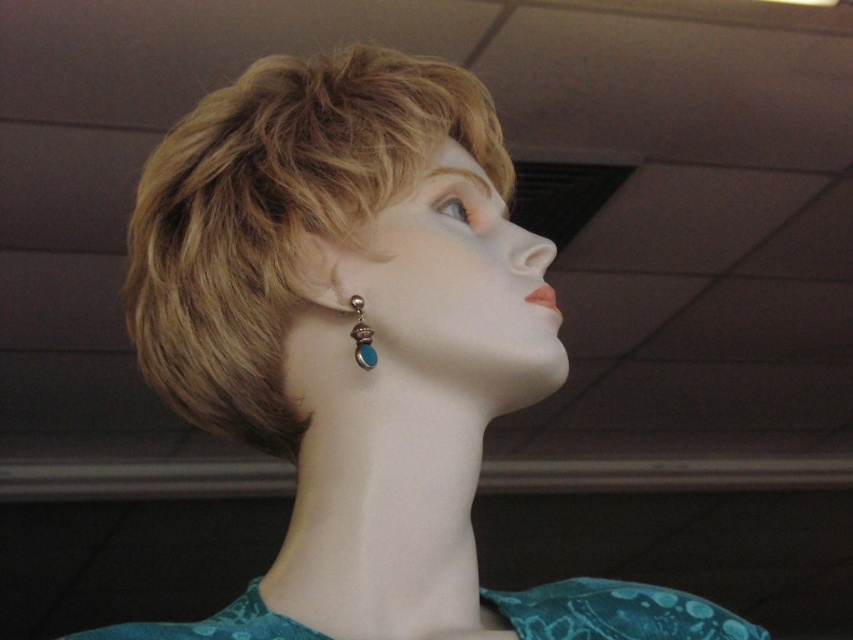
You are a stylist working on a mannequin head. You need to place a hair accessory exactly at the coordinates where the blonde hair at upper center is located. What are the coordinates where you should place the accessory?

The coordinates for the blonde hair at upper center are at point (x=277, y=216).

You are a stylist trying to arrange accessories for a mannequin. The mannequin has blonde hair at upper center and turquoise gemstone drop at lower left. Which accessory is placed higher on the mannequin?

The blonde hair at upper center is positioned higher than the turquoise gemstone drop at lower left.

You are a fashion designer arranging items in a store display. You have a teal fabric dress at lower center and a turquoise gemstone drop at lower left. Which item is positioned lower in the display?

The teal fabric dress at lower center is positioned lower than the turquoise gemstone drop at lower left.